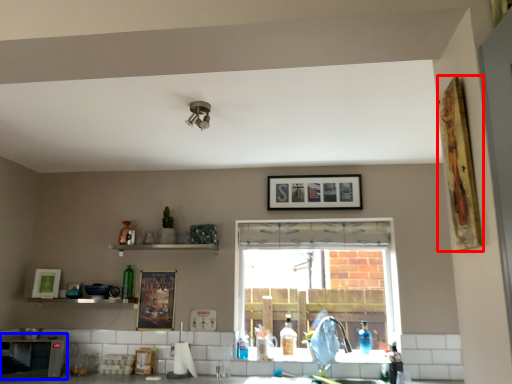
Question: Which object is closer to the camera taking this photo, picture frame (highlighted by a red box) or appliance (highlighted by a blue box)?

Choices:
 (A) picture frame
 (B) appliance

Answer: (A)